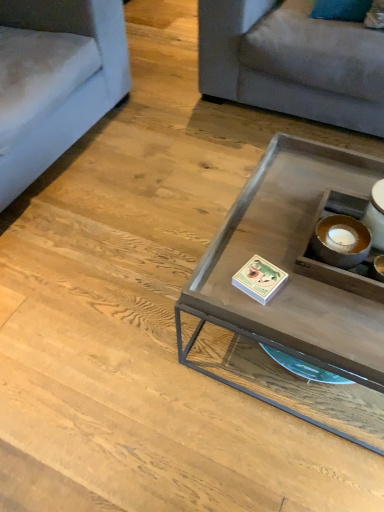
The image size is (384, 512). I want to click on vacant space situated on the left part of light gray fabric couch at upper right, which is counted as the second studio couch, starting from the left, so click(x=158, y=97).